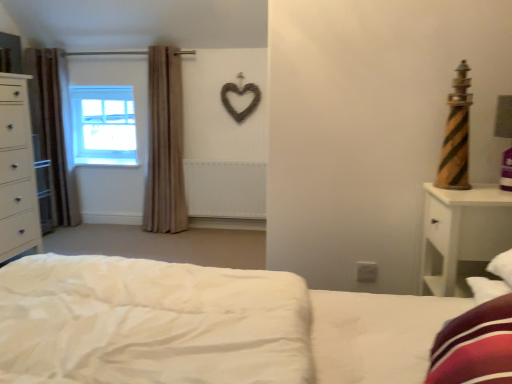
At what (x,y) coordinates should I click in order to perform the action: click on beige fabric curtain at left, which ranks as the 1th curtain in right-to-left order. Please return your answer as a coordinate pair (x, y). This screenshot has height=384, width=512. Looking at the image, I should click on (165, 144).

Image resolution: width=512 pixels, height=384 pixels. Find the location of `clear glass window at upper left`. clear glass window at upper left is located at coordinates (103, 125).

Measure the distance between point (x=259, y=188) and camera.

They are 12.14 feet apart.

The image size is (512, 384). What are the coordinates of `beige fabric curtain at left, which ranks as the 1th curtain in right-to-left order` in the screenshot? It's located at (165, 144).

Is brown fabric curtain at left, which appears as the second curtain when viewed from the right, oriented towards beige fabric curtain at left, the second curtain positioned from the left?

No, brown fabric curtain at left, which appears as the second curtain when viewed from the right, is not facing towards beige fabric curtain at left, the second curtain positioned from the left.

Which is behind, point (55, 219) or point (151, 176)?

The point (55, 219) is more distant.

Is brown fabric curtain at left, which appears as the second curtain when viewed from the right, wider than beige fabric curtain at left, the second curtain positioned from the left?

In fact, brown fabric curtain at left, which appears as the second curtain when viewed from the right, might be narrower than beige fabric curtain at left, the second curtain positioned from the left.

Considering the positions of objects brown fabric curtain at left, which appears as the second curtain when viewed from the right, and beige fabric curtain at left, the second curtain positioned from the left, in the image provided, who is more to the left, brown fabric curtain at left, which appears as the second curtain when viewed from the right, or beige fabric curtain at left, the second curtain positioned from the left,?

brown fabric curtain at left, which appears as the second curtain when viewed from the right.

Looking at this image, from a real-world perspective, relative to beige fabric curtain at left, which ranks as the 1th curtain in right-to-left order, is white matte radiator at center vertically above or below?

From a real-world perspective, white matte radiator at center is physically below beige fabric curtain at left, which ranks as the 1th curtain in right-to-left order.

Is point (198, 169) closer to viewer compared to point (173, 51)?

No, it is behind (173, 51).

From the image's perspective, which is above, white matte radiator at center or beige fabric curtain at left, the second curtain positioned from the left?

beige fabric curtain at left, the second curtain positioned from the left.

Which object is further away from the camera taking this photo, white matte radiator at center or beige fabric curtain at left, the second curtain positioned from the left?

white matte radiator at center.

Is beige fabric curtain at left, the second curtain positioned from the left, at the left side of brown fabric curtain at left, acting as the 1th curtain starting from the left?

No.

Is beige fabric curtain at left, the second curtain positioned from the left, facing away from brown fabric curtain at left, acting as the 1th curtain starting from the left?

That's not correct — beige fabric curtain at left, the second curtain positioned from the left, is not looking away from brown fabric curtain at left, acting as the 1th curtain starting from the left.

Considering their positions, is beige fabric curtain at left, the second curtain positioned from the left, located in front of or behind brown fabric curtain at left, which appears as the second curtain when viewed from the right?

Clearly, beige fabric curtain at left, the second curtain positioned from the left, is in front of brown fabric curtain at left, which appears as the second curtain when viewed from the right.

This screenshot has width=512, height=384. I want to click on radiator on the right of brown fabric curtain at left, acting as the 1th curtain starting from the left, so click(225, 189).

Between white matte radiator at center and brown fabric curtain at left, acting as the 1th curtain starting from the left, which one has more height?

brown fabric curtain at left, acting as the 1th curtain starting from the left.

From the image's perspective, is white matte radiator at center above or below brown fabric curtain at left, which appears as the second curtain when viewed from the right?

Based on their image positions, white matte radiator at center is located beneath brown fabric curtain at left, which appears as the second curtain when viewed from the right.

Is brown fabric curtain at left, which appears as the second curtain when viewed from the right, next to white wood nightstand at right?

No, brown fabric curtain at left, which appears as the second curtain when viewed from the right, is not beside white wood nightstand at right.

From the image's perspective, is brown fabric curtain at left, which appears as the second curtain when viewed from the right, above or below white wood nightstand at right?

Clearly, from the image's perspective, brown fabric curtain at left, which appears as the second curtain when viewed from the right, is above white wood nightstand at right.

Is point (69, 179) closer or farther from the camera than point (490, 218)?

Point (69, 179) is farther from the camera than point (490, 218).

Which is correct: brown fabric curtain at left, acting as the 1th curtain starting from the left, is inside white wood nightstand at right, or outside of it?

brown fabric curtain at left, acting as the 1th curtain starting from the left, lies outside white wood nightstand at right.

Is white matte radiator at center wider than white glossy chest of drawers at left?

In fact, white matte radiator at center might be narrower than white glossy chest of drawers at left.

Is white matte radiator at center further to the viewer compared to white glossy chest of drawers at left?

Yes, it is.

Which of these two, white matte radiator at center or white glossy chest of drawers at left, stands shorter?

With less height is white matte radiator at center.

Does white matte radiator at center appear on the right side of white glossy chest of drawers at left?

Yes, white matte radiator at center is to the right of white glossy chest of drawers at left.

Does point (60, 69) come farther from viewer compared to point (19, 181)?

Yes, it is.

Could you tell me if brown fabric curtain at left, acting as the 1th curtain starting from the left, is facing white glossy chest of drawers at left?

Yes, brown fabric curtain at left, acting as the 1th curtain starting from the left, faces towards white glossy chest of drawers at left.

In order to click on the chest of drawers lying in front of the brown fabric curtain at left, acting as the 1th curtain starting from the left in this screenshot , I will do `click(17, 171)`.

Considering the relative sizes of brown fabric curtain at left, acting as the 1th curtain starting from the left, and white glossy chest of drawers at left in the image provided, is brown fabric curtain at left, acting as the 1th curtain starting from the left, taller than white glossy chest of drawers at left?

Yes, brown fabric curtain at left, acting as the 1th curtain starting from the left, is taller than white glossy chest of drawers at left.

Image resolution: width=512 pixels, height=384 pixels. I want to click on curtain below the brown fabric curtain at left, acting as the 1th curtain starting from the left (from the image's perspective), so click(165, 144).

At what (x,y) coordinates should I click in order to perform the action: click on radiator that appears on the right of beige fabric curtain at left, which ranks as the 1th curtain in right-to-left order. Please return your answer as a coordinate pair (x, y). The height and width of the screenshot is (384, 512). Looking at the image, I should click on (225, 189).

Estimate the real-world distances between objects in this image. Which object is closer to white glossy chest of drawers at left, beige fabric curtain at left, which ranks as the 1th curtain in right-to-left order, or clear glass window at upper left?

The object closer to white glossy chest of drawers at left is beige fabric curtain at left, which ranks as the 1th curtain in right-to-left order.

When comparing their distances from beige fabric curtain at left, which ranks as the 1th curtain in right-to-left order, does white matte radiator at center or brown fabric curtain at left, acting as the 1th curtain starting from the left, seem further?

brown fabric curtain at left, acting as the 1th curtain starting from the left, is further to beige fabric curtain at left, which ranks as the 1th curtain in right-to-left order.

Estimate the real-world distances between objects in this image. Which object is closer to white glossy chest of drawers at left, beige fabric curtain at left, which ranks as the 1th curtain in right-to-left order, or white matte radiator at center?

Among the two, beige fabric curtain at left, which ranks as the 1th curtain in right-to-left order, is located nearer to white glossy chest of drawers at left.

Considering their positions, is beige fabric curtain at left, the second curtain positioned from the left, positioned closer to clear glass window at upper left than brown fabric curtain at left, which appears as the second curtain when viewed from the right?

Based on the image, brown fabric curtain at left, which appears as the second curtain when viewed from the right, appears to be nearer to clear glass window at upper left.

Based on their spatial positions, is beige fabric curtain at left, which ranks as the 1th curtain in right-to-left order, or clear glass window at upper left closer to brown fabric curtain at left, which appears as the second curtain when viewed from the right?

clear glass window at upper left is positioned closer to the anchor brown fabric curtain at left, which appears as the second curtain when viewed from the right.

Based on their spatial positions, is white wood nightstand at right or white matte radiator at center closer to white glossy chest of drawers at left?

white matte radiator at center is positioned closer to the anchor white glossy chest of drawers at left.

From the image, which object appears to be farther from brown fabric curtain at left, which appears as the second curtain when viewed from the right, beige fabric curtain at left, which ranks as the 1th curtain in right-to-left order, or white wood nightstand at right?

white wood nightstand at right.

Looking at the image, which one is located further to beige fabric curtain at left, which ranks as the 1th curtain in right-to-left order, clear glass window at upper left or brown fabric curtain at left, acting as the 1th curtain starting from the left?

The object further to beige fabric curtain at left, which ranks as the 1th curtain in right-to-left order, is brown fabric curtain at left, acting as the 1th curtain starting from the left.

Locate an element on the screen. This screenshot has height=384, width=512. radiator positioned between white wood nightstand at right and clear glass window at upper left from near to far is located at coordinates (225, 189).

The width and height of the screenshot is (512, 384). I want to click on chest of drawers between brown fabric curtain at left, acting as the 1th curtain starting from the left, and white wood nightstand at right, in the horizontal direction, so click(17, 171).

Locate an element on the screen. radiator between white glossy chest of drawers at left and white wood nightstand at right in the horizontal direction is located at coordinates (225, 189).

Locate an element on the screen. The image size is (512, 384). curtain between white glossy chest of drawers at left and white wood nightstand at right from left to right is located at coordinates (165, 144).